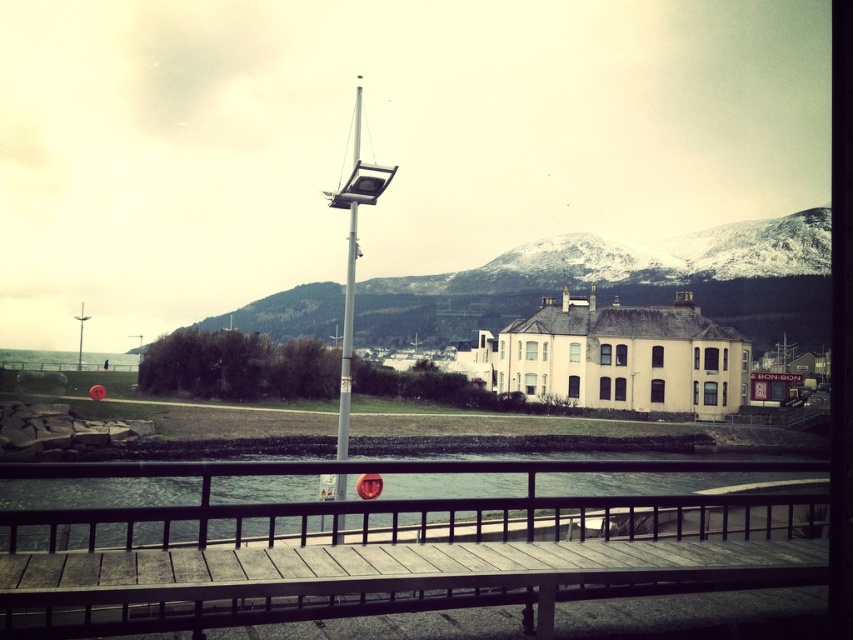
From the picture: You are standing on the wooden railing mentioned in the scene. You want to walk to the transparent glass water at lower center. Which direction should you move relative to the wooden dock at center?

You should move to the right relative to the wooden dock at center because the wooden dock at center is to the left of transparent glass water at lower center.

You are a delivery robot with a width of 1.8 meters. You need to move from the wooden dock at center to the transparent glass water at lower center. Can you fit through the space between them?

The wooden dock at center and transparent glass water at lower center are 1.93 meters apart from each other. Since your width is 1.8 meters, you can fit through the space between them as it is wider than your robot.

You are standing on the wooden railing and looking at the transparent glass water at lower center and the snowy rock formation at center. Which object is closer to you?

The transparent glass water at lower center is closer to you because it has a smaller size compared to the snowy rock formation at center, which suggests it is farther away.